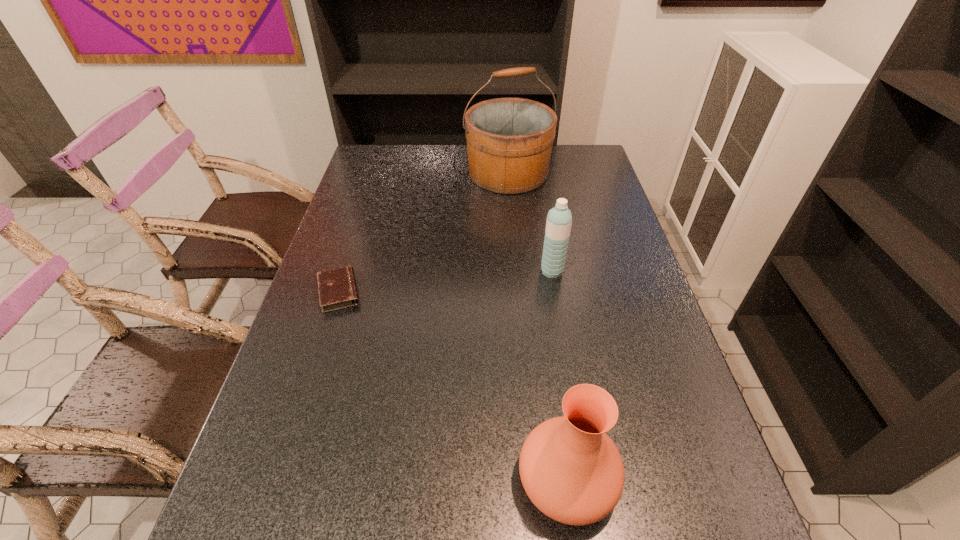
Find the location of a particular element. The image size is (960, 540). vacant area in the image that satisfies the following two spatial constraints: 1. on the front side of the bucket; 2. on the right side of the vase is located at coordinates (534, 480).

Locate an element on the screen. The height and width of the screenshot is (540, 960). free location that satisfies the following two spatial constraints: 1. on the back side of the leftmost object; 2. on the right side of the water bottle is located at coordinates (346, 271).